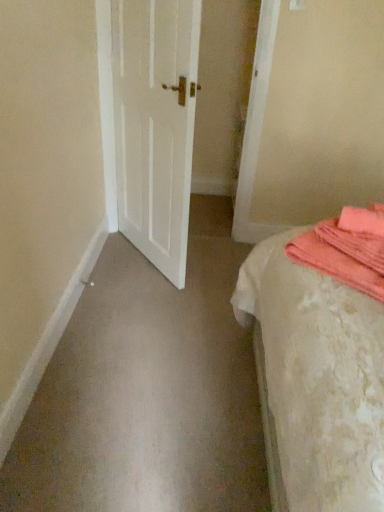
Question: Is white matte door at center at the back of white textured bed at right?

Choices:
 (A) no
 (B) yes

Answer: (A)

Question: Considering the relative sizes of white textured bed at right and white matte door at center in the image provided, is white textured bed at right thinner than white matte door at center?

Choices:
 (A) no
 (B) yes

Answer: (A)

Question: Is white textured bed at right at the right side of white matte door at center?

Choices:
 (A) no
 (B) yes

Answer: (B)

Question: Does white textured bed at right appear on the left side of white matte door at center?

Choices:
 (A) yes
 (B) no

Answer: (B)

Question: Is white textured bed at right wider than white matte door at center?

Choices:
 (A) yes
 (B) no

Answer: (A)

Question: In terms of size, does white textured bed at right appear bigger or smaller than coral soft towel at right?

Choices:
 (A) big
 (B) small

Answer: (A)

Question: Is white textured bed at right inside the boundaries of coral soft towel at right, or outside?

Choices:
 (A) outside
 (B) inside

Answer: (A)

Question: Is white textured bed at right wider or thinner than coral soft towel at right?

Choices:
 (A) thin
 (B) wide

Answer: (B)

Question: From a real-world perspective, is white textured bed at right physically located above or below coral soft towel at right?

Choices:
 (A) above
 (B) below

Answer: (B)

Question: In the image, is white textured bed at right on the left side or the right side of white matte door at center?

Choices:
 (A) left
 (B) right

Answer: (B)

Question: From the image's perspective, is white textured bed at right located above or below white matte door at center?

Choices:
 (A) below
 (B) above

Answer: (A)

Question: Is white textured bed at right in front of or behind white matte door at center in the image?

Choices:
 (A) front
 (B) behind

Answer: (A)

Question: Would you say white textured bed at right is inside or outside white matte door at center?

Choices:
 (A) outside
 (B) inside

Answer: (A)

Question: Is white matte door at center spatially inside white textured bed at right, or outside of it?

Choices:
 (A) inside
 (B) outside

Answer: (B)

Question: From a real-world perspective, is white matte door at center above or below white textured bed at right?

Choices:
 (A) below
 (B) above

Answer: (B)